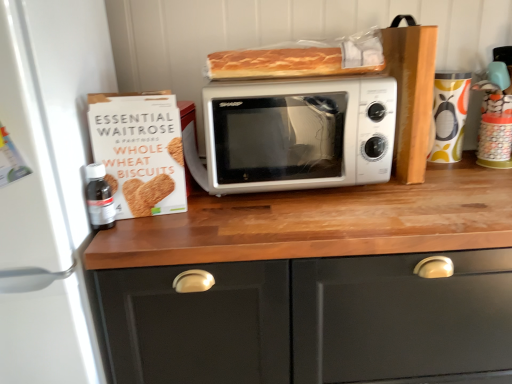
Question: Can you confirm if matte wood cabinet at center is positioned to the right of matte ceramic mug at right, positioned as the 1th appliance in right-to-left order?

Choices:
 (A) yes
 (B) no

Answer: (B)

Question: Is matte wood cabinet at center shorter than matte ceramic mug at right, the second appliance in the left-to-right sequence?

Choices:
 (A) no
 (B) yes

Answer: (A)

Question: Is matte wood cabinet at center beside matte ceramic mug at right, positioned as the 1th appliance in right-to-left order?

Choices:
 (A) no
 (B) yes

Answer: (A)

Question: From a real-world perspective, is matte wood cabinet at center physically below matte ceramic mug at right, the second appliance in the left-to-right sequence?

Choices:
 (A) no
 (B) yes

Answer: (B)

Question: Can you confirm if matte wood cabinet at center is taller than matte ceramic mug at right, the second appliance in the left-to-right sequence?

Choices:
 (A) yes
 (B) no

Answer: (A)

Question: Is matte wood cabinet at center completely or partially outside of matte ceramic mug at right, positioned as the 1th appliance in right-to-left order?

Choices:
 (A) yes
 (B) no

Answer: (A)

Question: Is white matte microwave at center not within transparent plastic bottle at left?

Choices:
 (A) yes
 (B) no

Answer: (A)

Question: Does white matte microwave at center appear on the right side of transparent plastic bottle at left?

Choices:
 (A) no
 (B) yes

Answer: (B)

Question: Is white matte microwave at center at the left side of transparent plastic bottle at left?

Choices:
 (A) yes
 (B) no

Answer: (B)

Question: Is white matte microwave at center positioned far away from transparent plastic bottle at left?

Choices:
 (A) no
 (B) yes

Answer: (A)

Question: Considering the relative sizes of white matte microwave at center and transparent plastic bottle at left in the image provided, is white matte microwave at center taller than transparent plastic bottle at left?

Choices:
 (A) yes
 (B) no

Answer: (A)

Question: From a real-world perspective, is white matte microwave at center positioned over transparent plastic bottle at left based on gravity?

Choices:
 (A) no
 (B) yes

Answer: (B)

Question: Considering the relative sizes of matte wood cabinet at center and white cardboard box at left in the image provided, is matte wood cabinet at center shorter than white cardboard box at left?

Choices:
 (A) yes
 (B) no

Answer: (B)